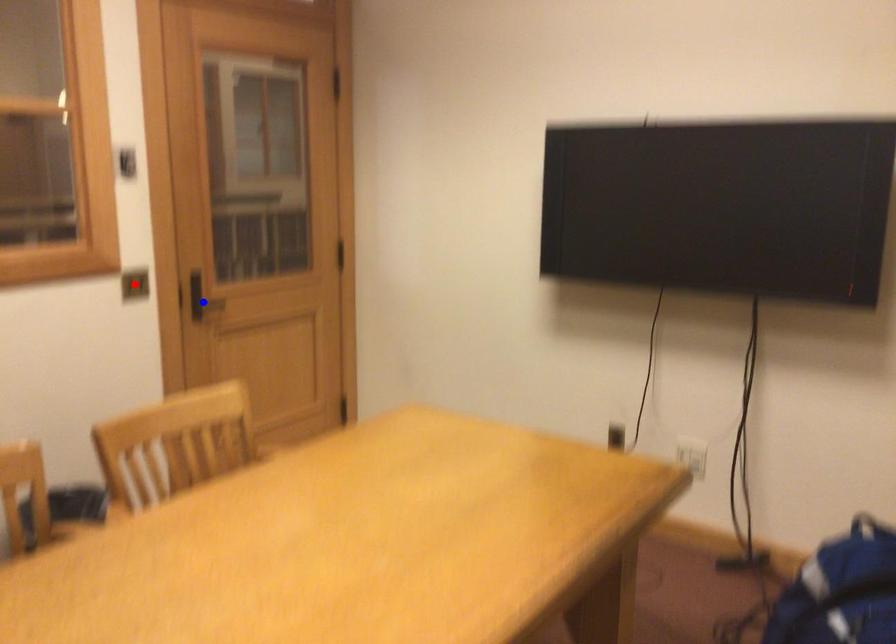
Question: Which of the two points in the image is closer to the camera?

Choices:
 (A) Blue point is closer.
 (B) Red point is closer.

Answer: (B)